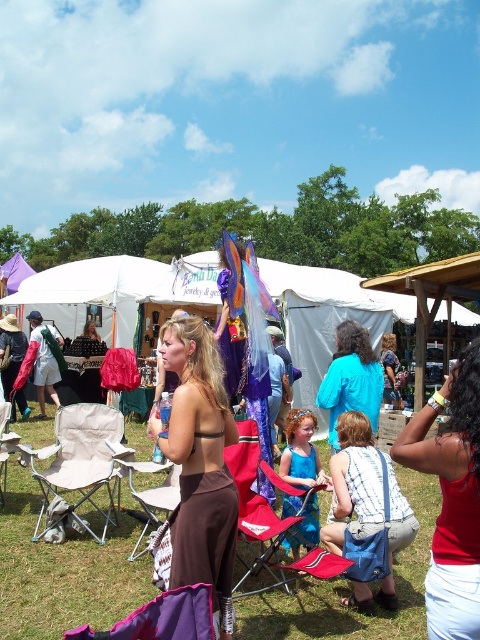
Does matte red tank top at lower right have a lesser height compared to blue cotton shirt at center?

No.

Is point (479, 339) farther from camera compared to point (346, 365)?

No, (479, 339) is closer to viewer.

The width and height of the screenshot is (480, 640). Describe the element at coordinates (451, 497) in the screenshot. I see `matte red tank top at lower right` at that location.

Find the location of a particular element. This screenshot has height=640, width=480. matte red tank top at lower right is located at coordinates (451, 497).

Between matte red folding chair at center and turquoise fabric dress at center, which one is positioned higher?

Positioned higher is turquoise fabric dress at center.

Which is in front, point (239, 420) or point (286, 461)?

Point (286, 461) is in front.

Locate an element on the screen. The height and width of the screenshot is (640, 480). matte red folding chair at center is located at coordinates (252, 499).

Can you confirm if matte red tank top at lower right is positioned to the right of matte red folding chair at center?

Yes, matte red tank top at lower right is to the right of matte red folding chair at center.

Between point (451, 589) and point (252, 520), which one is positioned behind?

Positioned behind is point (252, 520).

This screenshot has height=640, width=480. In order to click on matte red tank top at lower right in this screenshot , I will do `click(451, 497)`.

Identify the location of matte red tank top at lower right. point(451,497).